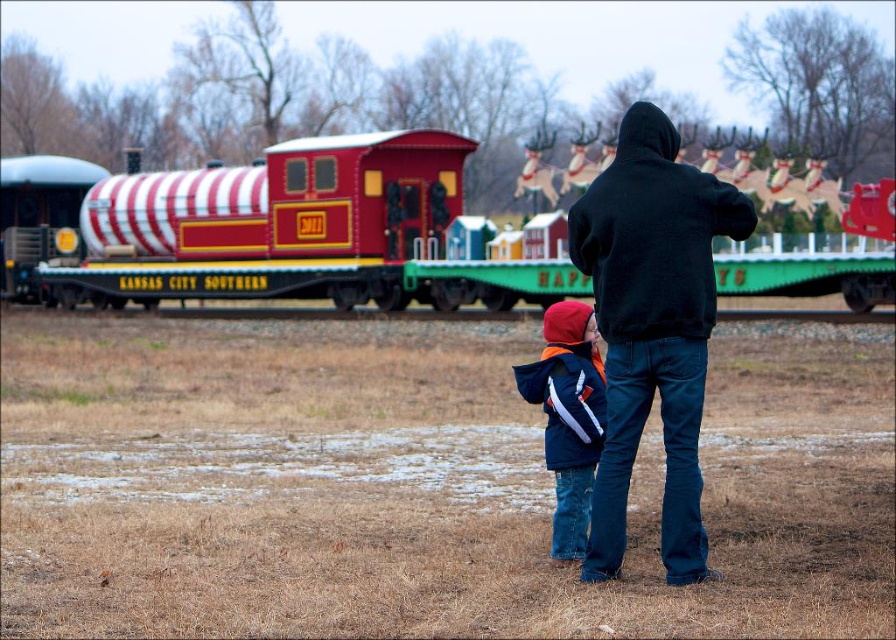
You are a photographer trying to capture a clear photo of the black hoodie at center and the navy blue jacket at center. Since the two are positioned close to each other, you want to ensure that both are visible. Which one should you focus on to make sure the other is also in focus?

You should focus on the black hoodie at center because it is in front of the navy blue jacket at center, so focusing on the closer subject will help keep both in focus.

You are standing in the scene and want to walk from the point at coordinates point (771, 291) to the point at coordinates point (561, 486). Which direction should you move to get closer to your destination?

You should move away from the camera because point (771, 291) is further to the camera than point (561, 486).

You are standing at the bottom of a hill and see the red and white striped train car at upper center and the black hoodie at center. Which object is higher up the hill?

The red and white striped train car at upper center is higher up the hill than the black hoodie at center because it is positioned above it.